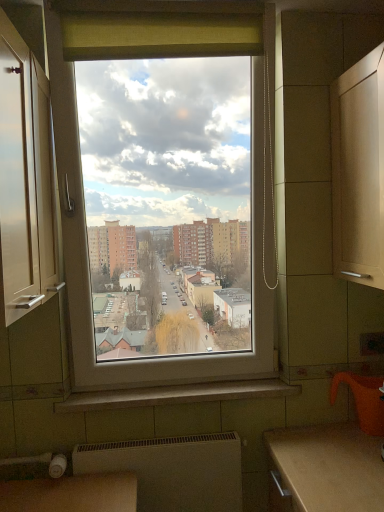
Question: From a real-world perspective, is white matte radiator at lower center physically above white glossy window sill at center?

Choices:
 (A) yes
 (B) no

Answer: (B)

Question: Considering the relative sizes of white matte radiator at lower center and white glossy window sill at center in the image provided, is white matte radiator at lower center thinner than white glossy window sill at center?

Choices:
 (A) no
 (B) yes

Answer: (B)

Question: Does white matte radiator at lower center appear on the right side of white glossy window sill at center?

Choices:
 (A) yes
 (B) no

Answer: (B)

Question: Is white matte radiator at lower center smaller than white glossy window sill at center?

Choices:
 (A) no
 (B) yes

Answer: (A)

Question: Is white matte radiator at lower center turned away from white glossy window sill at center?

Choices:
 (A) no
 (B) yes

Answer: (A)

Question: Is white matte radiator at lower center beside white glossy window sill at center?

Choices:
 (A) no
 (B) yes

Answer: (A)

Question: From the image's perspective, would you say white glossy window sill at center is shown under white matte radiator at lower center?

Choices:
 (A) no
 (B) yes

Answer: (A)

Question: Considering the relative positions of white glossy window sill at center and white matte radiator at lower center in the image provided, is white glossy window sill at center to the left of white matte radiator at lower center from the viewer's perspective?

Choices:
 (A) yes
 (B) no

Answer: (B)

Question: Is white glossy window sill at center taller than white matte radiator at lower center?

Choices:
 (A) no
 (B) yes

Answer: (A)

Question: Are white glossy window sill at center and white matte radiator at lower center beside each other?

Choices:
 (A) yes
 (B) no

Answer: (B)

Question: Is the depth of white glossy window sill at center less than that of white matte radiator at lower center?

Choices:
 (A) yes
 (B) no

Answer: (B)

Question: Does white glossy window sill at center have a smaller size compared to white matte radiator at lower center?

Choices:
 (A) no
 (B) yes

Answer: (B)

Question: Is white matte radiator at lower center completely or partially inside white glossy cabinet at left?

Choices:
 (A) yes
 (B) no

Answer: (B)